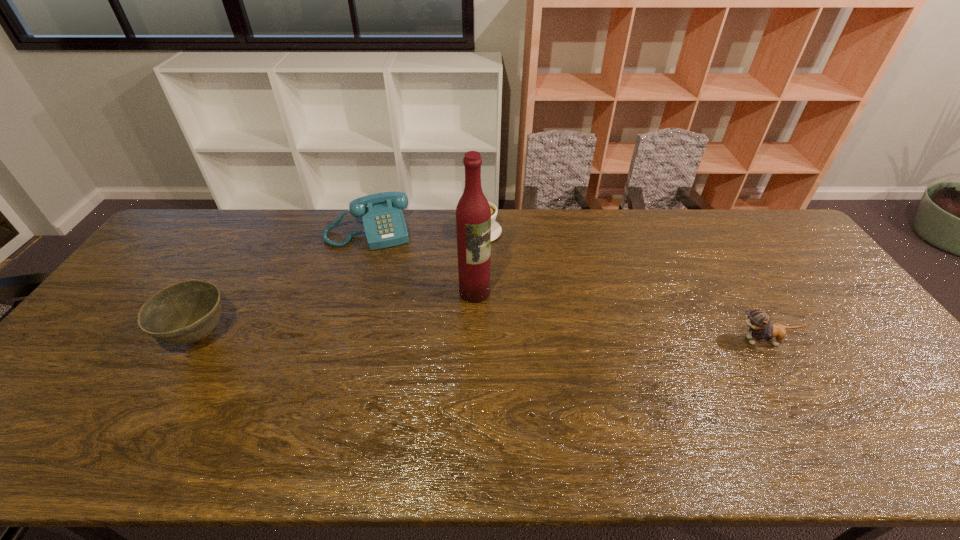
Image resolution: width=960 pixels, height=540 pixels. In order to click on bowl in this screenshot , I will do `click(185, 312)`.

You are a GUI agent. You are given a task and a screenshot of the screen. Output one action in this format:
    pyautogui.click(x=<x>, y=<y>)
    Task: Click on the rightmost object
    
    Given the screenshot: What is the action you would take?
    pyautogui.click(x=758, y=320)

This screenshot has height=540, width=960. Find the location of `the shortest object`. the shortest object is located at coordinates (496, 230).

I want to click on the tallest object, so click(x=473, y=213).

Identify the location of the third farthest object. (473, 213).

Identify the location of the fourth object from right to left. (384, 225).

Find the location of a particular element. The width and height of the screenshot is (960, 540). vacant space located on the back of the bowl is located at coordinates (262, 230).

You are a GUI agent. You are given a task and a screenshot of the screen. Output one action in this format:
    pyautogui.click(x=<x>, y=<y>)
    Task: Click on the vacant space located on the front-facing side of the rightmost object
    This screenshot has width=960, height=540.
    Given the screenshot: What is the action you would take?
    (x=654, y=341)

The width and height of the screenshot is (960, 540). Find the location of `vacant space located 0.150m on the front-facing side of the rightmost object`. vacant space located 0.150m on the front-facing side of the rightmost object is located at coordinates [x=676, y=341].

The image size is (960, 540). In order to click on free region located 0.340m on the front-facing side of the rightmost object in this screenshot , I will do `click(605, 341)`.